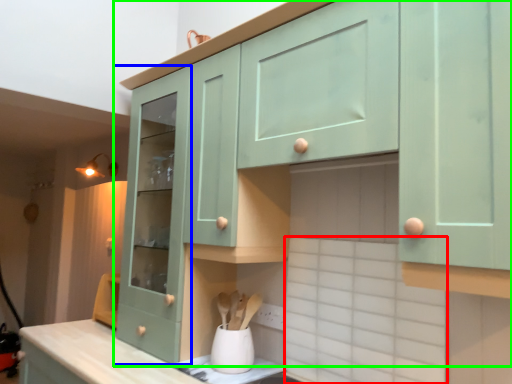
Question: Which object is positioned closest to ceramic tile (highlighted by a red box)? Select from cabinetry (highlighted by a blue box) and cabinetry (highlighted by a green box).

Choices:
 (A) cabinetry
 (B) cabinetry

Answer: (B)